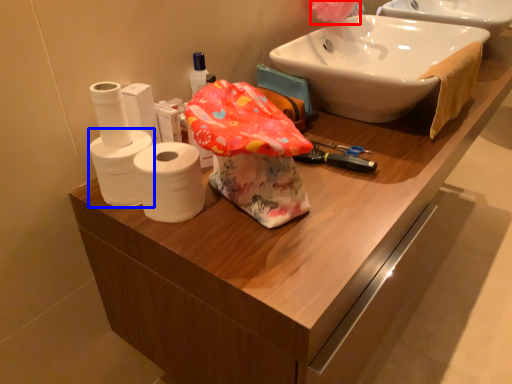
Question: Which object appears farthest to the camera in this image, flower (highlighted by a red box) or toilet paper (highlighted by a blue box)?

Choices:
 (A) flower
 (B) toilet paper

Answer: (A)